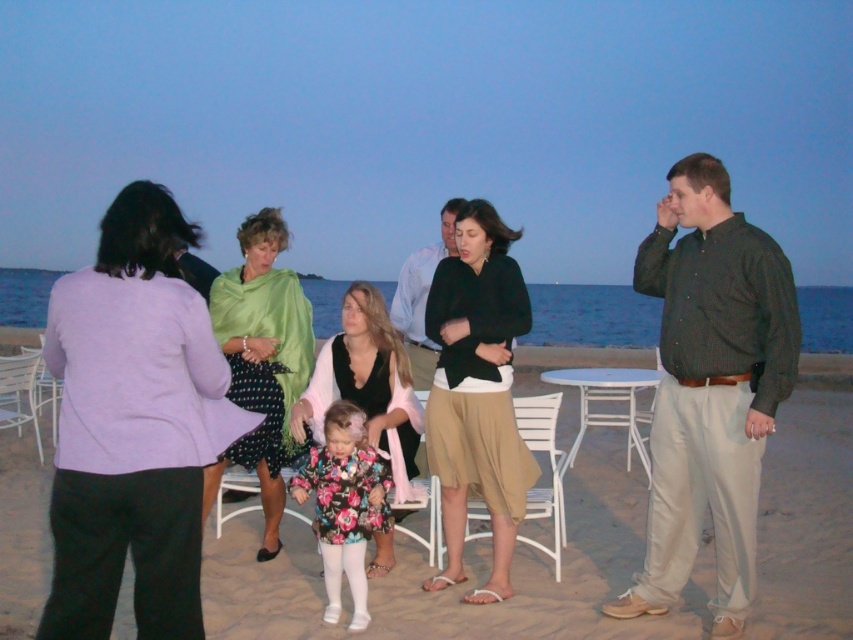
Where is `dark green textured shirt at right`? Image resolution: width=853 pixels, height=640 pixels. dark green textured shirt at right is located at coordinates (711, 388).

Which is behind, point (740, 580) or point (361, 321)?

The point (361, 321) is behind.

Locate an element on the screen. dark green textured shirt at right is located at coordinates (711, 388).

Between beige sand at center and metallic white chair at left, which one is positioned lower?

Positioned lower is beige sand at center.

Does beige sand at center have a greater width compared to metallic white chair at left?

Indeed, beige sand at center has a greater width compared to metallic white chair at left.

Is point (299, 532) positioned before point (45, 380)?

Yes.

Identify the location of beige sand at center. This screenshot has width=853, height=640. (550, 570).

Does white plastic chair at center have a lesser height compared to white plastic chair at lower left?

No.

Is white plastic chair at center closer to the viewer compared to white plastic chair at lower left?

Yes, white plastic chair at center is closer to the viewer.

Is point (555, 531) positioned in front of point (35, 362)?

Yes, it is.

Locate an element on the screen. white plastic chair at center is located at coordinates (549, 468).